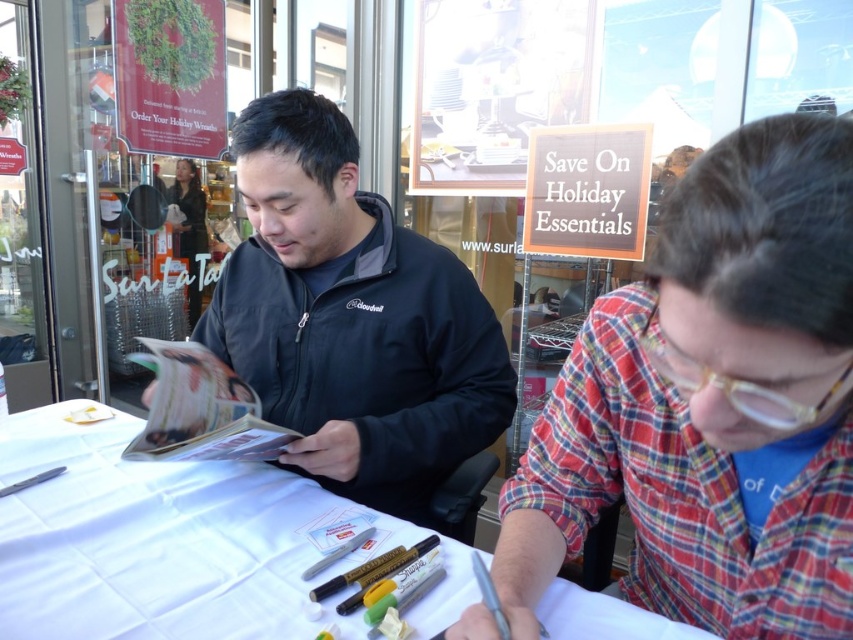
Question: Which object is the closest to the black matte jacket at center?

Choices:
 (A) plaid shirt at right
 (B) white paper at center

Answer: (B)

Question: Does black matte jacket at center appear over white paper at center?

Choices:
 (A) yes
 (B) no

Answer: (A)

Question: Which of the following is the closest to the observer?

Choices:
 (A) plaid shirt at right
 (B) white paper at center
 (C) black matte jacket at center

Answer: (A)

Question: Does plaid shirt at right appear on the left side of white paper at center?

Choices:
 (A) no
 (B) yes

Answer: (A)

Question: Is plaid shirt at right to the right of black matte jacket at center from the viewer's perspective?

Choices:
 (A) no
 (B) yes

Answer: (B)

Question: Which point appears farthest from the camera in this image?

Choices:
 (A) (521, 570)
 (B) (109, 422)
 (C) (355, 355)

Answer: (B)